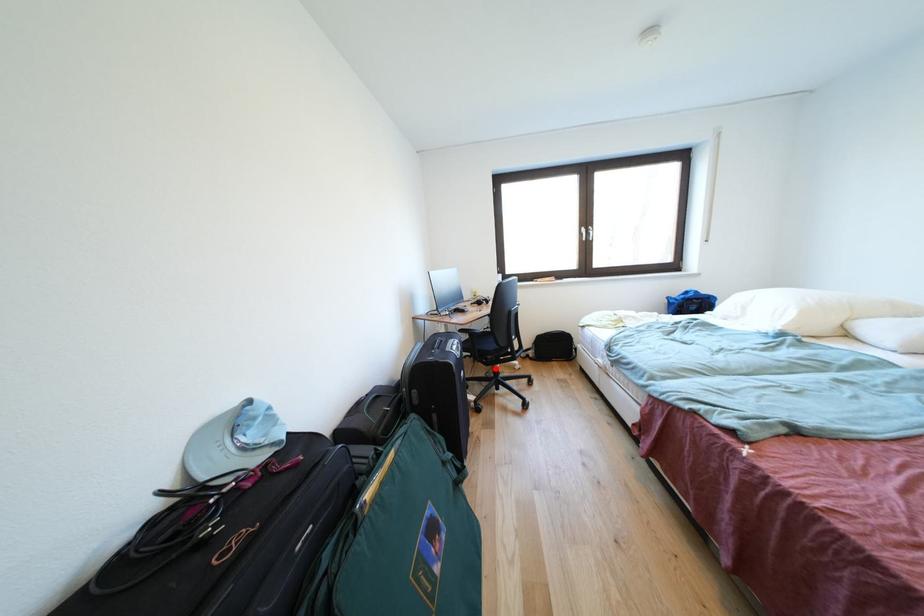
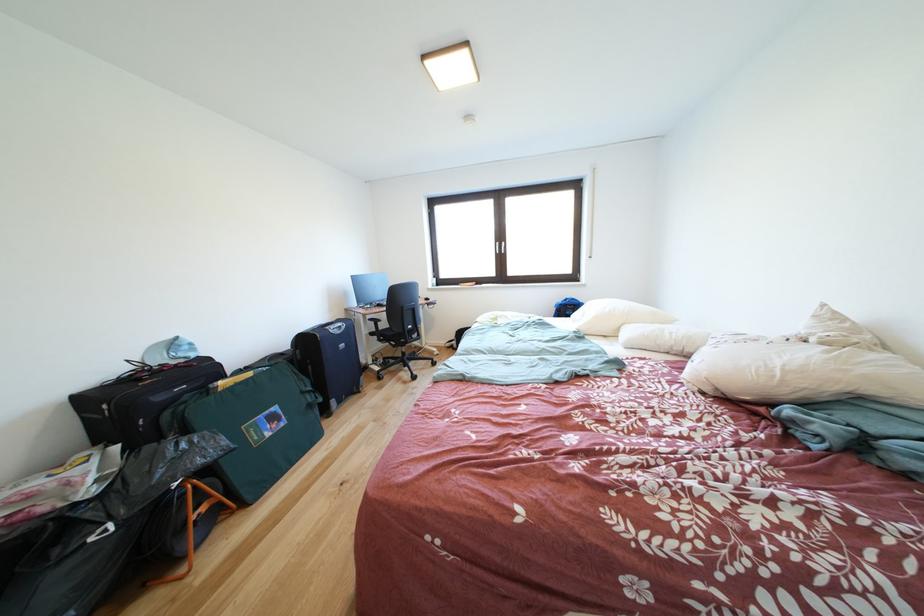
Question: I am providing you with two images of the same scene from different viewpoints. In image1, a red point is highlighted. Considering the same 3D point in image2, which of the following is correct?

Choices:
 (A) It is closer
 (B) It is farther

Answer: (B)